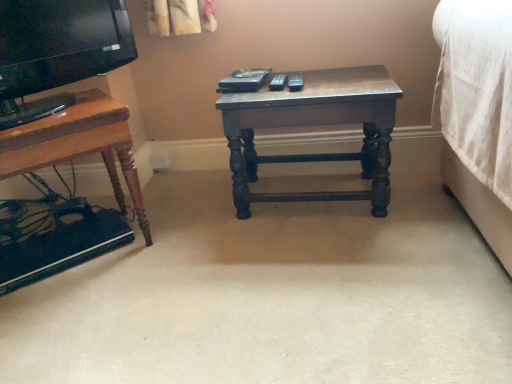
Find the location of a particular element. vacant area that lies to the right of wooden table at left, placed as the second table when sorted from right to left is located at coordinates (190, 241).